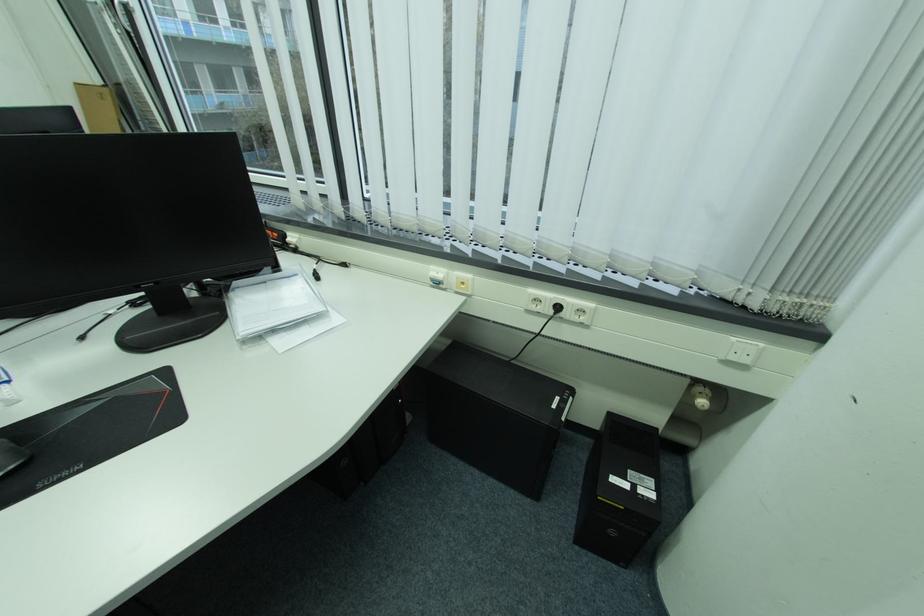
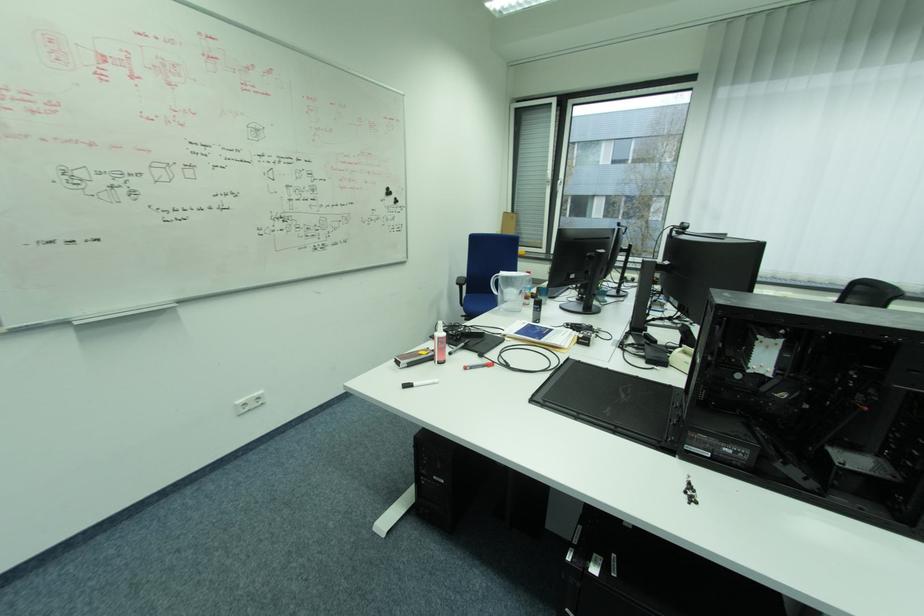
In a continuous first-person perspective shot, in which direction is the camera moving?

The cameraman walked toward left, backward.